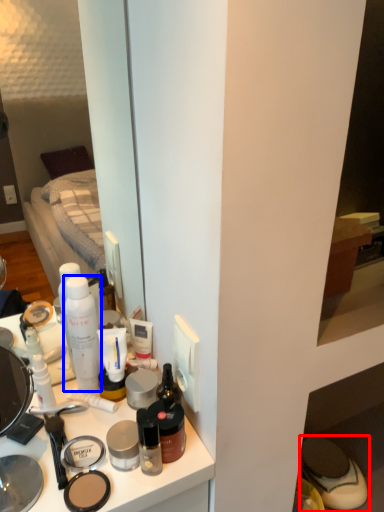
Question: Which point is further to the camera, footwear (highlighted by a red box) or toiletry (highlighted by a blue box)?

Choices:
 (A) footwear
 (B) toiletry

Answer: (A)